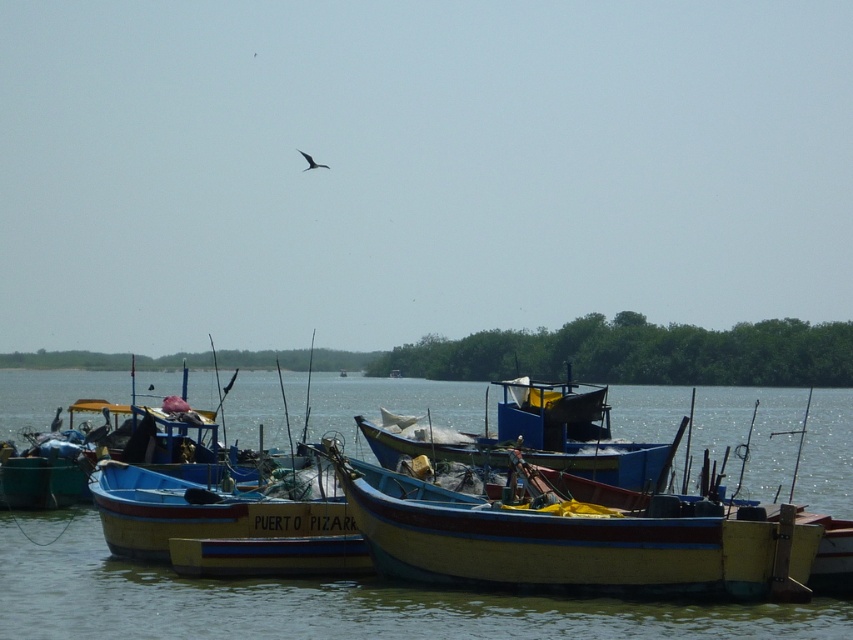
You are a fisherman standing on the dock and see the smooth water at center and the blue painted wood boat at center. Which object is located directly above the other?

The blue painted wood boat at center is positioned above the smooth water at center, as the water is underneath the boat.

Based on the photo, you are an observer standing on the riverside. You see the smooth water at center and the wooden blue boat at center. Which object is located lower in the scene?

The smooth water at center is positioned under the wooden blue boat at center, so it is located lower in the scene.